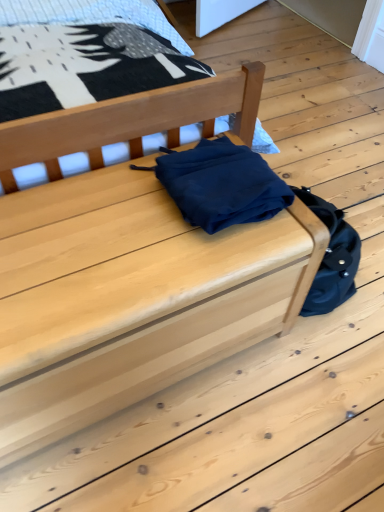
Find the location of a particular element. blank space situated above matte wood chest at center, arranged as the 1th furniture when ordered from the bottom (from a real-world perspective) is located at coordinates (87, 250).